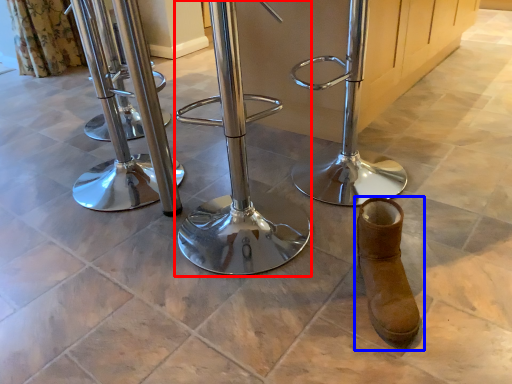
Question: Among these objects, which one is nearest to the camera, swivel chair (highlighted by a red box) or footwear (highlighted by a blue box)?

Choices:
 (A) swivel chair
 (B) footwear

Answer: (A)